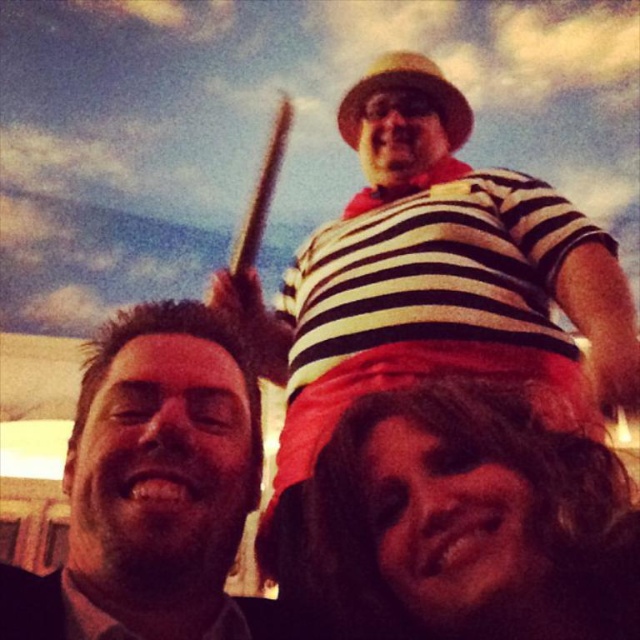
Question: Considering the relative positions of striped cotton shirt at upper center and dark curly hair at lower center in the image provided, where is striped cotton shirt at upper center located with respect to dark curly hair at lower center?

Choices:
 (A) right
 (B) left

Answer: (B)

Question: Which object is the closest to the dark curly hair at lower center?

Choices:
 (A) striped cotton shirt at upper center
 (B) dark brown hair at left

Answer: (A)

Question: Considering the real-world distances, which object is farthest from the dark curly hair at lower center?

Choices:
 (A) dark brown hair at left
 (B) striped cotton shirt at upper center

Answer: (A)

Question: Which is farther from the dark curly hair at lower center?

Choices:
 (A) dark brown hair at left
 (B) striped cotton shirt at upper center

Answer: (A)

Question: Does striped cotton shirt at upper center have a larger size compared to dark curly hair at lower center?

Choices:
 (A) no
 (B) yes

Answer: (B)

Question: Is striped cotton shirt at upper center below dark brown hair at left?

Choices:
 (A) yes
 (B) no

Answer: (B)